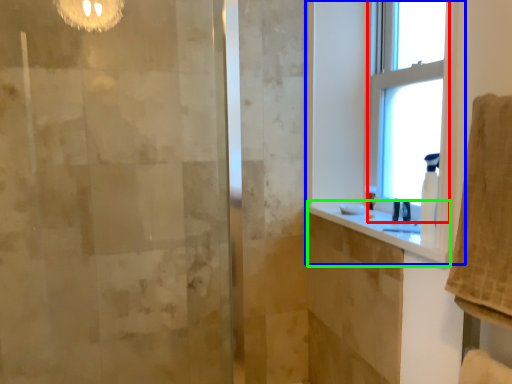
Question: Which object is the farthest from window (highlighted by a red box)? Choose among these: window (highlighted by a blue box) or counter top (highlighted by a green box).

Choices:
 (A) window
 (B) counter top

Answer: (B)